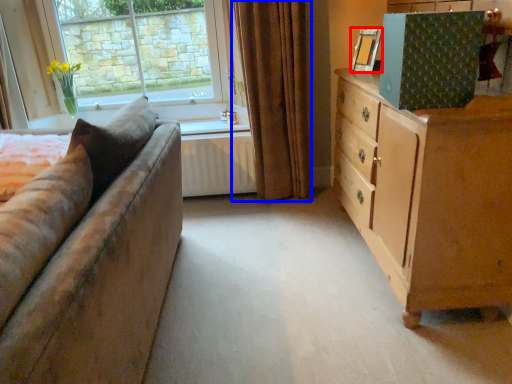
Question: Which of the following is the closest to the observer, picture frame (highlighted by a red box) or curtain (highlighted by a blue box)?

Choices:
 (A) picture frame
 (B) curtain

Answer: (A)